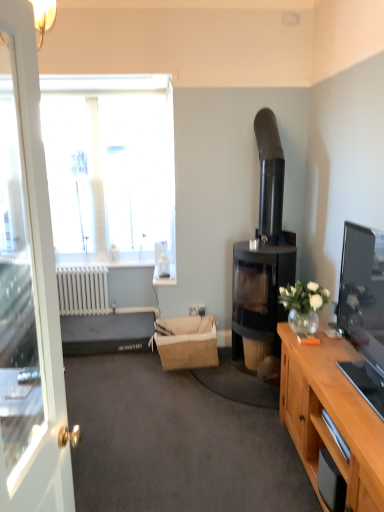
Identify the location of vacant space in front of brown woven picnic basket at center. Image resolution: width=384 pixels, height=512 pixels. (190, 382).